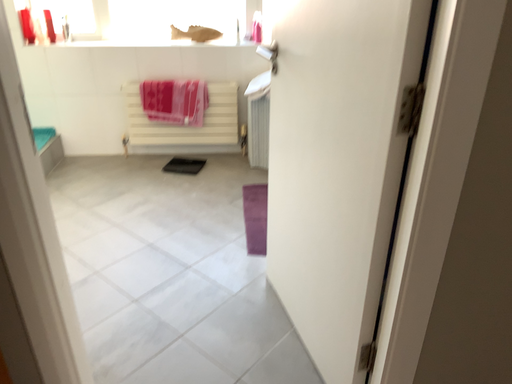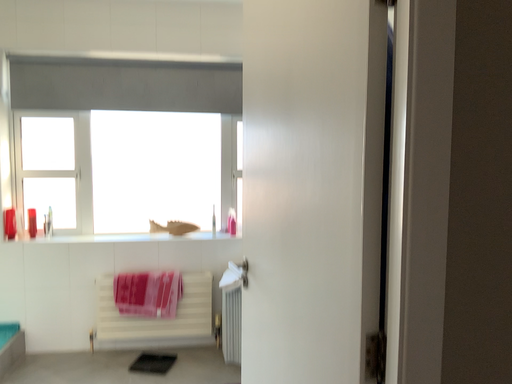
Question: How did the camera likely rotate when shooting the video?

Choices:
 (A) rotated downward
 (B) rotated upward

Answer: (B)